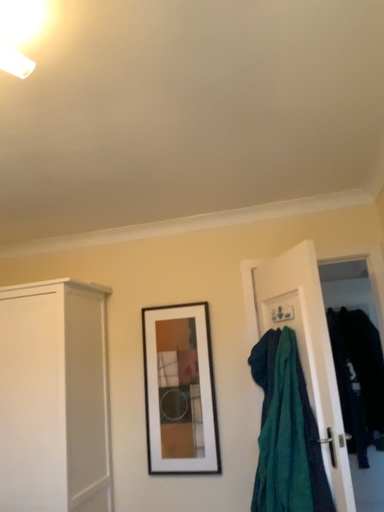
Question: Is teal fabric at right at the right side of wooden framed artwork at center?

Choices:
 (A) no
 (B) yes

Answer: (B)

Question: From the image's perspective, does teal fabric at right appear lower than wooden framed artwork at center?

Choices:
 (A) yes
 (B) no

Answer: (B)

Question: Is teal fabric at right outside of wooden framed artwork at center?

Choices:
 (A) yes
 (B) no

Answer: (A)

Question: From the image's perspective, is teal fabric at right on top of wooden framed artwork at center?

Choices:
 (A) yes
 (B) no

Answer: (A)

Question: Is wooden framed artwork at center inside teal fabric at right?

Choices:
 (A) yes
 (B) no

Answer: (B)

Question: Is teal fabric at right to the left of wooden framed artwork at center from the viewer's perspective?

Choices:
 (A) no
 (B) yes

Answer: (A)

Question: Could you tell me if wooden framed artwork at center is facing dark blue fabric at right?

Choices:
 (A) no
 (B) yes

Answer: (A)

Question: From the image's perspective, is wooden framed artwork at center located above dark blue fabric at right?

Choices:
 (A) no
 (B) yes

Answer: (B)

Question: Is wooden framed artwork at center far from dark blue fabric at right?

Choices:
 (A) yes
 (B) no

Answer: (A)

Question: From the image's perspective, is wooden framed artwork at center below dark blue fabric at right?

Choices:
 (A) no
 (B) yes

Answer: (A)

Question: Is the position of wooden framed artwork at center less distant than that of dark blue fabric at right?

Choices:
 (A) yes
 (B) no

Answer: (A)

Question: Is wooden framed artwork at center smaller than dark blue fabric at right?

Choices:
 (A) yes
 (B) no

Answer: (A)

Question: Is wooden framed artwork at center thinner than white matte cabinet at left?

Choices:
 (A) no
 (B) yes

Answer: (B)